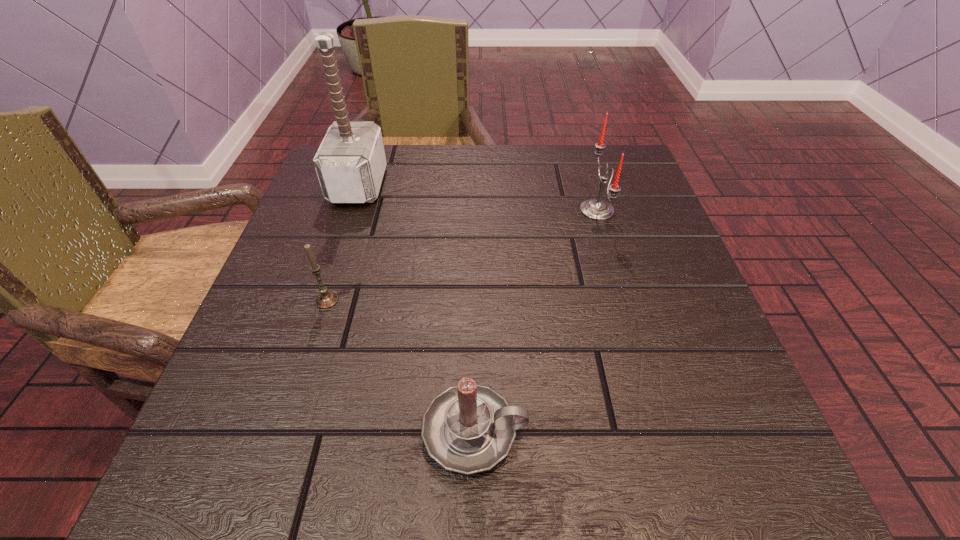
Identify which object is the second closest to the second nearest object. Please provide its 2D coordinates. Your answer should be formatted as a tuple, i.e. [(x, y)], where the tuple contains the x and y coordinates of a point satisfying the conditions above.

[(350, 163)]

Point out which candle is positioned as the nearest to the hammer. Please provide its 2D coordinates. Your answer should be formatted as a tuple, i.e. [(x, y)], where the tuple contains the x and y coordinates of a point satisfying the conditions above.

[(326, 299)]

Identify which candle is the nearest to the leftmost candle. Please provide its 2D coordinates. Your answer should be formatted as a tuple, i.e. [(x, y)], where the tuple contains the x and y coordinates of a point satisfying the conditions above.

[(469, 428)]

I want to click on vacant point that satisfies the following two spatial constraints: 1. for striking with the head of the leftmost candle; 2. on the left side of the hammer, so click(320, 300).

Where is `vacant area that satisfies the following two spatial constraints: 1. on the back side of the second nearest object; 2. for striking with the head of the hammer`? The image size is (960, 540). vacant area that satisfies the following two spatial constraints: 1. on the back side of the second nearest object; 2. for striking with the head of the hammer is located at coordinates (364, 185).